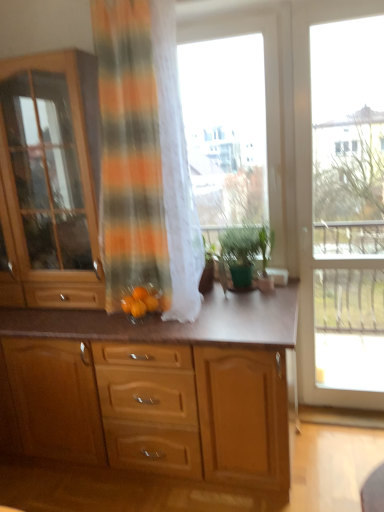
Locate an element on the screen. orange matte tangerine at center, which ranks as the second tangerine in right-to-left order is located at coordinates (140, 293).

This screenshot has width=384, height=512. What do you see at coordinates (311, 197) in the screenshot? I see `transparent glass door at right, which ranks as the first window in right-to-left order` at bounding box center [311, 197].

Identify the location of wooden cabinet at center, marked as the first cabinetry in a bottom-to-top arrangement. (150, 414).

Image resolution: width=384 pixels, height=512 pixels. Describe the element at coordinates (266, 103) in the screenshot. I see `transparent glass window at center, which ranks as the second window in right-to-left order` at that location.

What do you see at coordinates (151, 303) in the screenshot?
I see `orange matte tangerine at center, the second tangerine positioned from the left` at bounding box center [151, 303].

The height and width of the screenshot is (512, 384). Describe the element at coordinates (245, 251) in the screenshot. I see `green matte plant at center` at that location.

Where is `green matte plant at center`? green matte plant at center is located at coordinates point(266,245).

In order to click on orange matte tangerine at center, which appears as the first tangerine when viewed from the left in this screenshot , I will do `click(140, 293)`.

Considering the relative positions of transparent glass window at center, which ranks as the second window in right-to-left order, and orange matte tangerine at center, arranged as the first tangerine when viewed from the right, in the image provided, is transparent glass window at center, which ranks as the second window in right-to-left order, to the left or to the right of orange matte tangerine at center, arranged as the first tangerine when viewed from the right,?

transparent glass window at center, which ranks as the second window in right-to-left order, is positioned on orange matte tangerine at center, arranged as the first tangerine when viewed from the right,'s right side.

From the image's perspective, starting from the orange matte tangerine at center, arranged as the first tangerine when viewed from the right, which window is the 2nd one above? Please provide its 2D coordinates.

[(266, 103)]

From a real-world perspective, is transparent glass window at center, which ranks as the second window in right-to-left order, located beneath orange matte tangerine at center, arranged as the first tangerine when viewed from the right?

No, from a real-world perspective, transparent glass window at center, which ranks as the second window in right-to-left order, is not below orange matte tangerine at center, arranged as the first tangerine when viewed from the right.

Which object is wider, transparent glass window at center, which ranks as the first window in left-to-right order, or orange matte tangerine at center, arranged as the first tangerine when viewed from the right?

Wider between the two is transparent glass window at center, which ranks as the first window in left-to-right order.

Is green matte plant at center next to transparent glass window at center, which ranks as the second window in right-to-left order?

No, green matte plant at center is not in contact with transparent glass window at center, which ranks as the second window in right-to-left order.

Visually, is green matte plant at center positioned to the left or to the right of transparent glass window at center, which ranks as the second window in right-to-left order?

In the image, green matte plant at center appears on the right side of transparent glass window at center, which ranks as the second window in right-to-left order.

Looking at this image, looking at their sizes, would you say green matte plant at center is wider or thinner than transparent glass window at center, which ranks as the second window in right-to-left order?

In the image, green matte plant at center appears to be wider than transparent glass window at center, which ranks as the second window in right-to-left order.

From the image's perspective, which one is positioned lower, green matte plant at center or transparent glass window at center, which ranks as the first window in left-to-right order?

green matte plant at center.

Who is smaller, orange striped fabric at center or orange matte tangerine at center, arranged as the first tangerine when viewed from the right?

orange matte tangerine at center, arranged as the first tangerine when viewed from the right.

Which tangerine is the 1st one when counting from the back of the orange striped fabric at center? Please provide its 2D coordinates.

[(151, 303)]

Is orange striped fabric at center at the left side of orange matte tangerine at center, arranged as the first tangerine when viewed from the right?

Yes, orange striped fabric at center is to the left of orange matte tangerine at center, arranged as the first tangerine when viewed from the right.

Which is nearer, (149, 52) or (156, 297)?

Point (149, 52).

Which object is further away from the camera, orange striped fabric at center or orange matte tangerine at center, which ranks as the second tangerine in right-to-left order?

orange matte tangerine at center, which ranks as the second tangerine in right-to-left order, is further from the camera.

You are a GUI agent. You are given a task and a screenshot of the screen. Output one action in this format:
    pyautogui.click(x=<x>, y=<y>)
    Task: Click on the curtain that appears above the orange matte tangerine at center, which ranks as the second tangerine in right-to-left order (from a real-world perspective)
    The height and width of the screenshot is (512, 384).
    Given the screenshot: What is the action you would take?
    pyautogui.click(x=145, y=159)

How far apart are orange striped fabric at center and orange matte tangerine at center, which appears as the first tangerine when viewed from the left?

26.05 inches.

Is orange striped fabric at center next to orange matte tangerine at center, which appears as the first tangerine when viewed from the left?

orange striped fabric at center and orange matte tangerine at center, which appears as the first tangerine when viewed from the left, are clearly separated.

Is white wood window frame at center facing towards orange matte tangerine at center, arranged as the first tangerine when viewed from the right?

Yes, white wood window frame at center is turned towards orange matte tangerine at center, arranged as the first tangerine when viewed from the right.

From a real-world perspective, which object stands above the other?

In real-world perspective, white wood window frame at center is above.

Is white wood window frame at center not near orange matte tangerine at center, arranged as the first tangerine when viewed from the right?

That's right, there is a large distance between white wood window frame at center and orange matte tangerine at center, arranged as the first tangerine when viewed from the right.

Considering the positions of points (291, 112) and (152, 297), is point (291, 112) farther from camera compared to point (152, 297)?

That is True.

From a real-world perspective, is wooden cabinet at left, marked as the first cabinetry in a top-to-bottom arrangement, physically below transparent glass door at right, which ranks as the first window in right-to-left order?

Incorrect, from a real-world perspective, wooden cabinet at left, marked as the first cabinetry in a top-to-bottom arrangement, is higher than transparent glass door at right, which ranks as the first window in right-to-left order.

From the picture: Can you see wooden cabinet at left, which is the 2th cabinetry in bottom-to-top order, touching transparent glass door at right, which ranks as the first window in right-to-left order?

There is a gap between wooden cabinet at left, which is the 2th cabinetry in bottom-to-top order, and transparent glass door at right, which ranks as the first window in right-to-left order.

Is wooden cabinet at left, which is the 2th cabinetry in bottom-to-top order, looking in the opposite direction of transparent glass door at right, which appears as the second window when viewed from the left?

wooden cabinet at left, which is the 2th cabinetry in bottom-to-top order, is not turned away from transparent glass door at right, which appears as the second window when viewed from the left.

Consider the image. Do you think wooden cabinet at left, which is the 2th cabinetry in bottom-to-top order, is within transparent glass door at right, which ranks as the first window in right-to-left order, or outside of it?

wooden cabinet at left, which is the 2th cabinetry in bottom-to-top order, is not enclosed by transparent glass door at right, which ranks as the first window in right-to-left order.

Considering the sizes of objects transparent glass door at right, which ranks as the first window in right-to-left order, and white wood window frame at center in the image provided, who is wider, transparent glass door at right, which ranks as the first window in right-to-left order, or white wood window frame at center?

transparent glass door at right, which ranks as the first window in right-to-left order.

From a real-world perspective, is transparent glass door at right, which ranks as the first window in right-to-left order, physically located above or below white wood window frame at center?

Clearly, from a real-world perspective, transparent glass door at right, which ranks as the first window in right-to-left order, is below white wood window frame at center.

What's the angular difference between transparent glass door at right, which ranks as the first window in right-to-left order, and white wood window frame at center's facing directions?

The angle between the facing direction of transparent glass door at right, which ranks as the first window in right-to-left order, and the facing direction of white wood window frame at center is 0.000993 degrees.

Which tangerine is the 1st one when counting from the left side of the transparent glass window at center, which ranks as the second window in right-to-left order? Please provide its 2D coordinates.

[(151, 303)]

Image resolution: width=384 pixels, height=512 pixels. In the image, there is a transparent glass window at center, which ranks as the first window in left-to-right order. Identify the location of houseplant below it (from a real-world perspective). pyautogui.click(x=245, y=251).

Considering their positions, is white wood window frame at center positioned closer to transparent glass door at right, which appears as the second window when viewed from the left, than transparent glass window at center, which ranks as the second window in right-to-left order?

white wood window frame at center.

From the image, which object appears to be nearer to orange matte tangerine at center, which ranks as the second tangerine in right-to-left order, green matte plant at center or transparent glass window at center, which ranks as the first window in left-to-right order?

Among the two, green matte plant at center is located nearer to orange matte tangerine at center, which ranks as the second tangerine in right-to-left order.

Looking at the image, which one is located further to green matte plant at center, orange matte tangerine at center, which appears as the first tangerine when viewed from the left, or orange striped fabric at center?

orange striped fabric at center lies further to green matte plant at center than the other object.

From the image, which object appears to be farther from wooden cabinet at left, which is the 2th cabinetry in bottom-to-top order, white wood window frame at center or wooden cabinet at center, which is the 2th cabinetry from top to bottom?

The object further to wooden cabinet at left, which is the 2th cabinetry in bottom-to-top order, is white wood window frame at center.

When comparing their distances from wooden cabinet at left, marked as the first cabinetry in a top-to-bottom arrangement, does transparent glass door at right, which ranks as the first window in right-to-left order, or orange striped fabric at center seem closer?

orange striped fabric at center lies closer to wooden cabinet at left, marked as the first cabinetry in a top-to-bottom arrangement, than the other object.

From the image, which object appears to be nearer to transparent glass window at center, which ranks as the first window in left-to-right order, wooden cabinet at center, marked as the first cabinetry in a bottom-to-top arrangement, or orange matte tangerine at center, the second tangerine positioned from the left?

orange matte tangerine at center, the second tangerine positioned from the left, is closer to transparent glass window at center, which ranks as the first window in left-to-right order.

From the image, which object appears to be nearer to orange striped fabric at center, green matte plant at center or wooden cabinet at center, marked as the first cabinetry in a bottom-to-top arrangement?

Among the two, green matte plant at center is located nearer to orange striped fabric at center.

Which object lies further to the anchor point white wood window frame at center, green matte plant at center or wooden cabinet at left, which is the 2th cabinetry in bottom-to-top order?

wooden cabinet at left, which is the 2th cabinetry in bottom-to-top order, is further to white wood window frame at center.

Where is `tangerine between wooden cabinet at left, marked as the first cabinetry in a top-to-bottom arrangement, and orange matte tangerine at center, the second tangerine positioned from the left`? tangerine between wooden cabinet at left, marked as the first cabinetry in a top-to-bottom arrangement, and orange matte tangerine at center, the second tangerine positioned from the left is located at coordinates (140, 293).

At what (x,y) coordinates should I click in order to perform the action: click on window frame located between orange striped fabric at center and transparent glass door at right, which ranks as the first window in right-to-left order, in the left-right direction. Please return your answer as a coordinate pair (x, y). This screenshot has width=384, height=512. Looking at the image, I should click on (288, 146).

This screenshot has height=512, width=384. In order to click on cabinetry situated between wooden cabinet at left, which is the 2th cabinetry in bottom-to-top order, and transparent glass door at right, which ranks as the first window in right-to-left order, from left to right in this screenshot , I will do `click(150, 414)`.

Find the location of a particular element. Image resolution: width=384 pixels, height=512 pixels. houseplant situated between orange matte tangerine at center, arranged as the first tangerine when viewed from the right, and green matte plant at center from left to right is located at coordinates (245, 251).